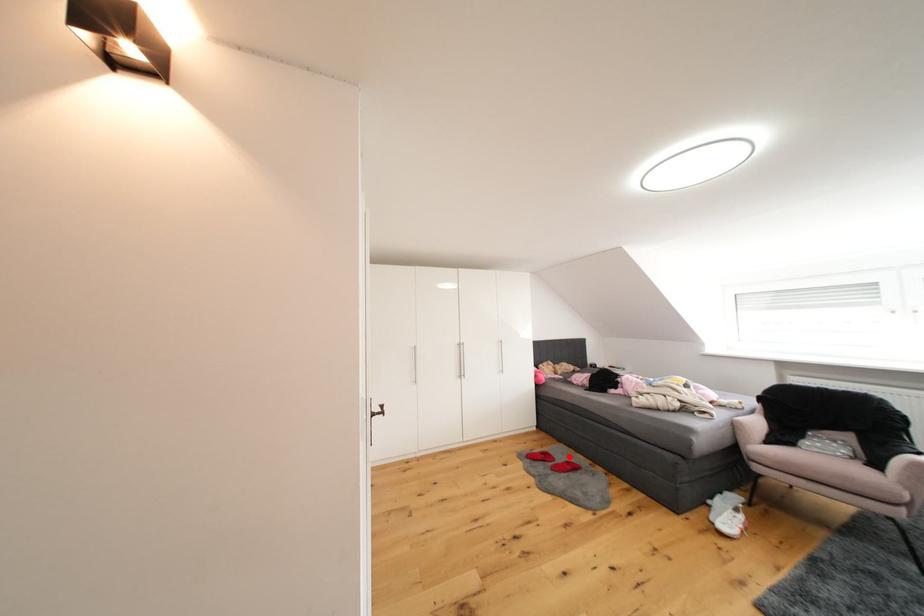
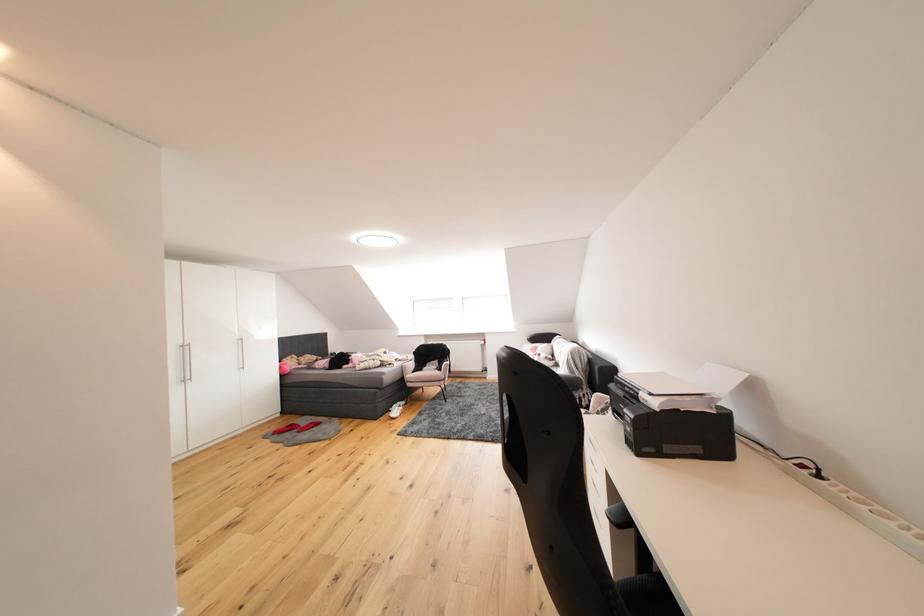
Question: I am providing you with two images of the same scene from different viewpoints. A red point is marked on the first image. Is the red point's position out of view in image 2?

Choices:
 (A) Yes
 (B) No

Answer: (B)